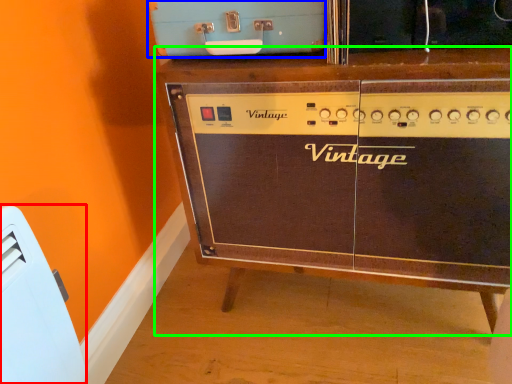
Question: Considering the real-world distances, which object is farthest from appliance (highlighted by a red box)? appliance (highlighted by a blue box) or furniture (highlighted by a green box)?

Choices:
 (A) appliance
 (B) furniture

Answer: (B)